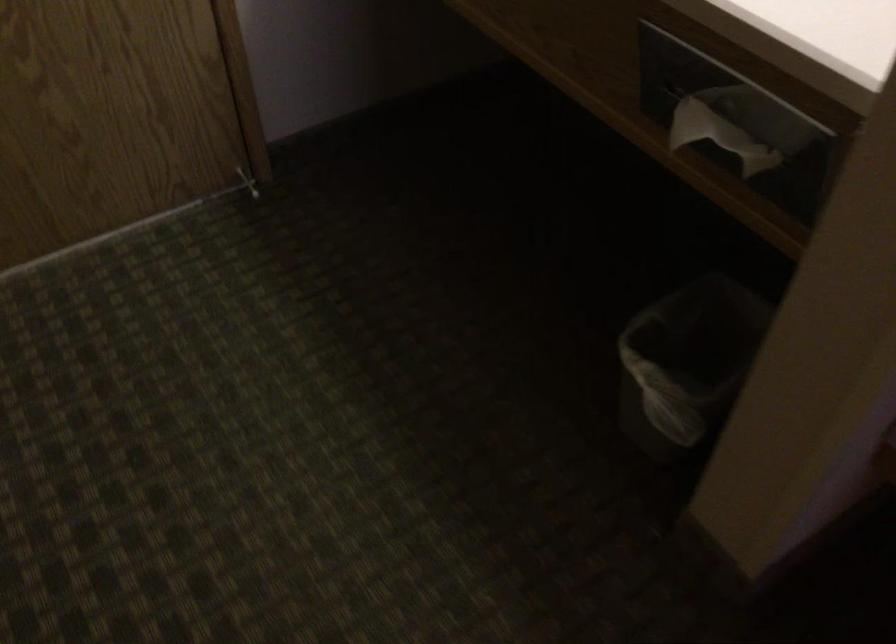
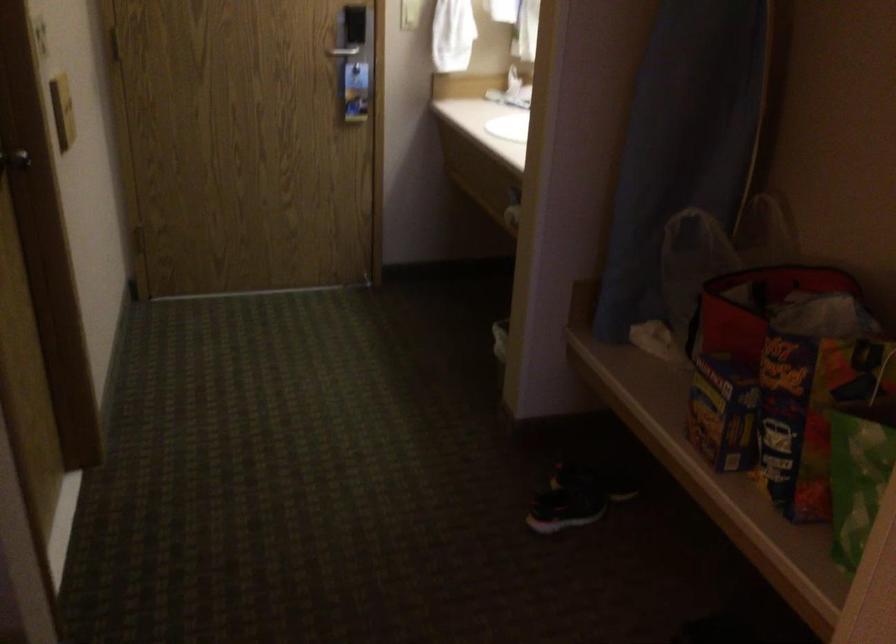
The images are taken continuously from a first-person perspective. In which direction are you moving?

The cameraman moved toward right, backward.